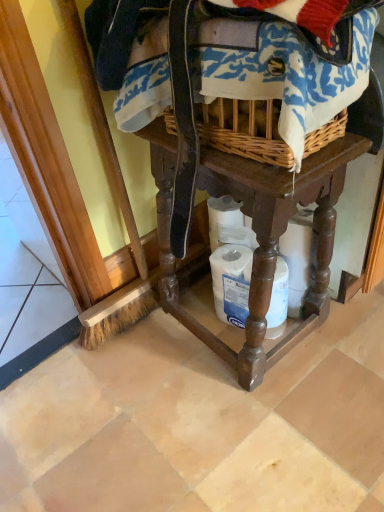
Question: Is white matte toilet paper at lower center turned away from brown wooden table at center?

Choices:
 (A) no
 (B) yes

Answer: (B)

Question: Does white matte toilet paper at lower center appear on the right side of brown wooden table at center?

Choices:
 (A) no
 (B) yes

Answer: (B)

Question: Is white matte toilet paper at lower center smaller than brown wooden table at center?

Choices:
 (A) yes
 (B) no

Answer: (A)

Question: Is white matte toilet paper at lower center further to camera compared to brown wooden table at center?

Choices:
 (A) no
 (B) yes

Answer: (B)

Question: Would you consider white matte toilet paper at lower center to be distant from brown wooden table at center?

Choices:
 (A) no
 (B) yes

Answer: (A)

Question: From a real-world perspective, is brown wooden table at center positioned above or below white matte toilet paper at lower center?

Choices:
 (A) above
 (B) below

Answer: (A)

Question: Considering their positions, is brown wooden table at center located in front of or behind white matte toilet paper at lower center?

Choices:
 (A) front
 (B) behind

Answer: (A)

Question: Is brown wooden table at center wider or thinner than white matte toilet paper at lower center?

Choices:
 (A) thin
 (B) wide

Answer: (B)

Question: In the image, is brown wooden table at center on the left side or the right side of white matte toilet paper at lower center?

Choices:
 (A) left
 (B) right

Answer: (A)

Question: From the image's perspective, is brown wooden table at center above or below woven fabric at upper center?

Choices:
 (A) above
 (B) below

Answer: (B)

Question: Considering the positions of brown wooden table at center and woven fabric at upper center in the image, is brown wooden table at center taller or shorter than woven fabric at upper center?

Choices:
 (A) tall
 (B) short

Answer: (A)

Question: Is brown wooden table at center wider or thinner than woven fabric at upper center?

Choices:
 (A) thin
 (B) wide

Answer: (A)

Question: Considering the positions of point (324, 311) and point (319, 58), is point (324, 311) closer or farther from the camera than point (319, 58)?

Choices:
 (A) farther
 (B) closer

Answer: (A)

Question: Is white matte toilet paper at lower center taller or shorter than brown wooden table at center?

Choices:
 (A) short
 (B) tall

Answer: (A)

Question: Would you say white matte toilet paper at lower center is inside or outside brown wooden table at center?

Choices:
 (A) inside
 (B) outside

Answer: (A)